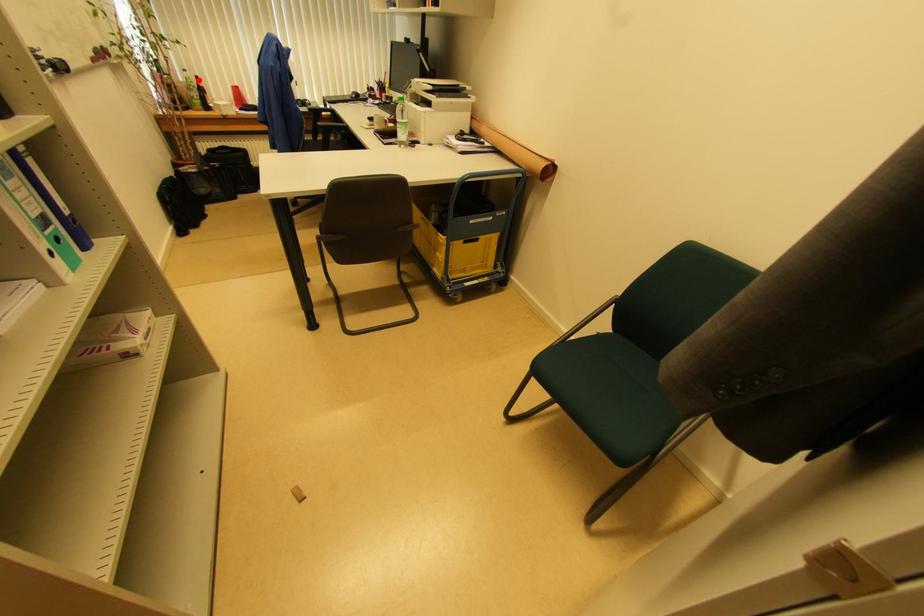
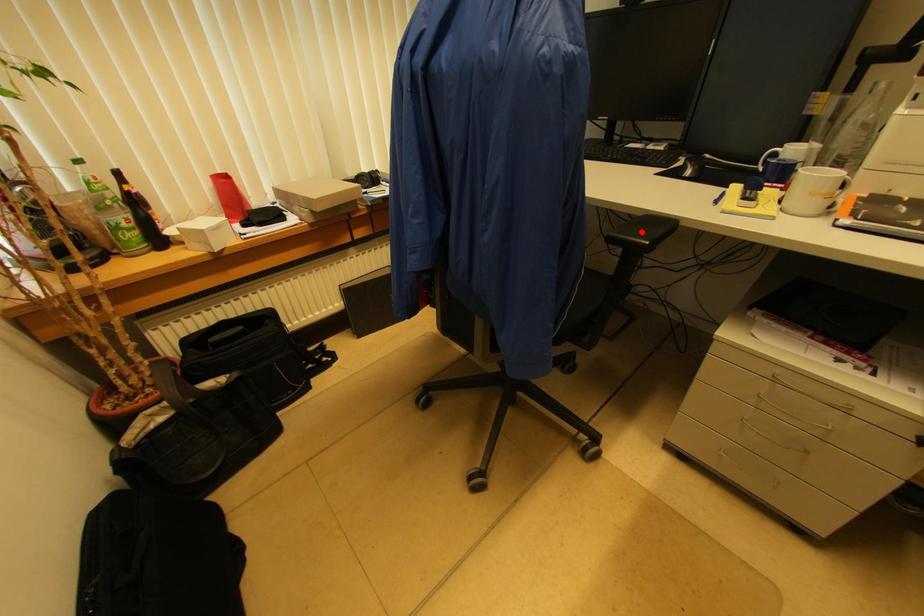
I am providing you with two images of the same scene from different viewpoints. A red point is marked on the first image and another point is marked on the second image. Is the red point in image1 aligned with the point shown in image2?

No